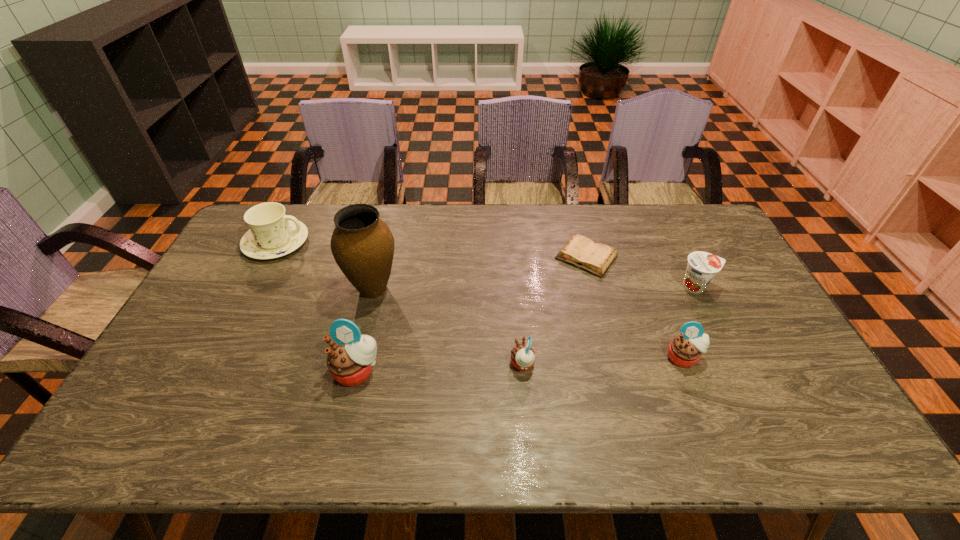
At what (x,y) coordinates should I click in order to perform the action: click on diary at the far edge. Please return your answer as a coordinate pair (x, y). This screenshot has width=960, height=540. Looking at the image, I should click on (580, 251).

This screenshot has width=960, height=540. In order to click on object located in the near edge section of the desktop in this screenshot , I will do `click(350, 360)`.

The width and height of the screenshot is (960, 540). I want to click on object at the left edge, so click(x=272, y=234).

I want to click on object that is at the right edge, so click(702, 266).

The width and height of the screenshot is (960, 540). I want to click on object positioned at the far left corner, so click(x=272, y=234).

Where is `free space at the far edge of the desktop`? free space at the far edge of the desktop is located at coordinates (481, 218).

I want to click on vacant position at the near edge of the desktop, so click(407, 401).

I want to click on free space at the left edge of the desktop, so click(x=241, y=288).

Find the location of `free spot at the right edge of the desktop`. free spot at the right edge of the desktop is located at coordinates (756, 313).

The image size is (960, 540). Identify the location of vacant space at the near left corner of the desktop. (165, 390).